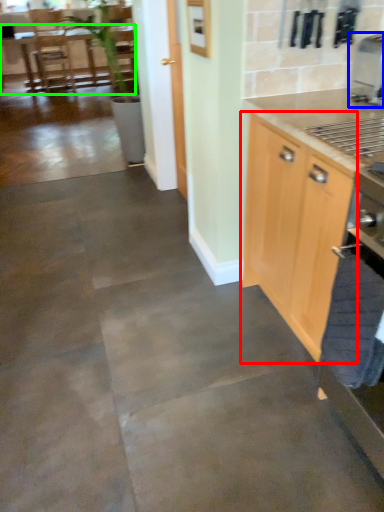
Question: Which is farther away from cabinetry (highlighted by a red box)? coffee machine (highlighted by a blue box) or table (highlighted by a green box)?

Choices:
 (A) coffee machine
 (B) table

Answer: (B)